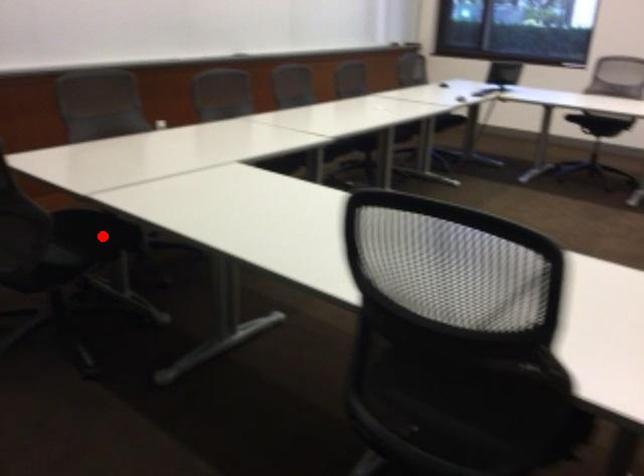
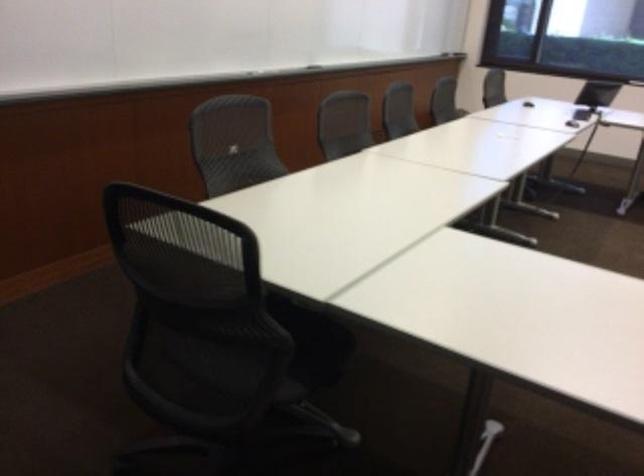
Find the pixel in the second image that matches the highlighted location in the first image.

(314, 341)